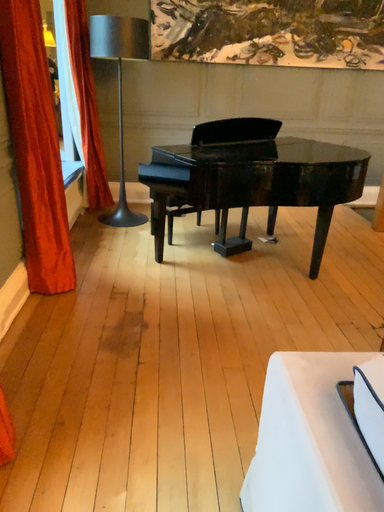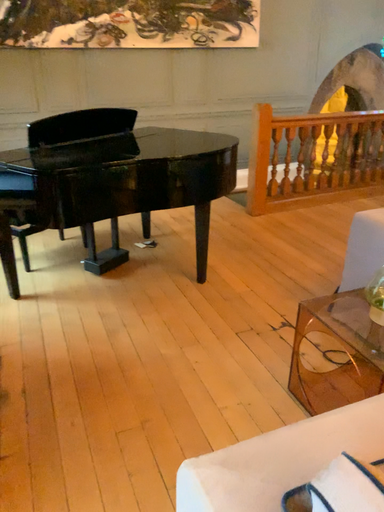
Question: How did the camera likely rotate when shooting the video?

Choices:
 (A) rotated right
 (B) rotated left

Answer: (A)